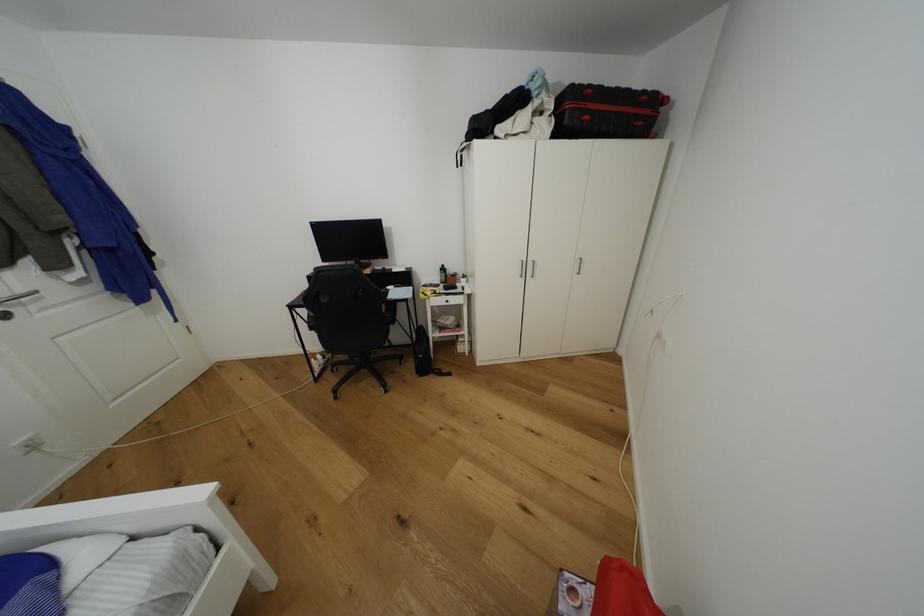
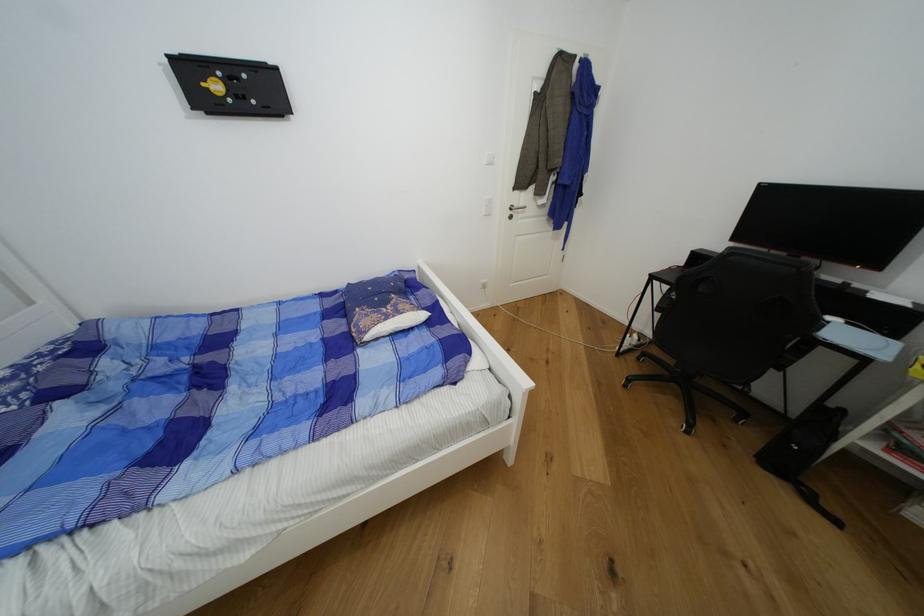
Find the pixel in the second image that matches [427,334] in the first image.

(833, 418)